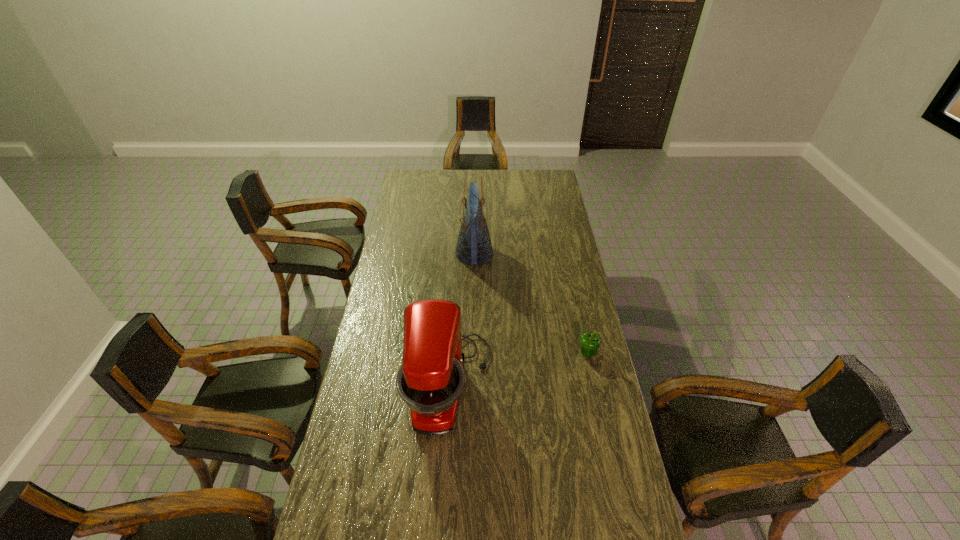
Where is `free space that is in between the shopping bag and the rightmost object`? This screenshot has width=960, height=540. free space that is in between the shopping bag and the rightmost object is located at coordinates (531, 303).

The height and width of the screenshot is (540, 960). I want to click on vacant space that is in between the farthest object and the bell pepper, so click(x=531, y=303).

Find the location of a particular element. free spot between the farthest object and the rightmost object is located at coordinates (531, 303).

Locate an element on the screen. This screenshot has height=540, width=960. object that can be found as the closest to the second tallest object is located at coordinates (589, 342).

Identify the location of object that is the closest to the shortest object. This screenshot has height=540, width=960. (430, 381).

This screenshot has width=960, height=540. Find the location of `blank space that satisfies the following two spatial constraints: 1. on the front side of the farthest object; 2. on the front-facing side of the second tallest object`. blank space that satisfies the following two spatial constraints: 1. on the front side of the farthest object; 2. on the front-facing side of the second tallest object is located at coordinates [472, 386].

The height and width of the screenshot is (540, 960). Find the location of `free spot that satisfies the following two spatial constraints: 1. on the front side of the farthest object; 2. on the front-facing side of the second shortest object`. free spot that satisfies the following two spatial constraints: 1. on the front side of the farthest object; 2. on the front-facing side of the second shortest object is located at coordinates (472, 386).